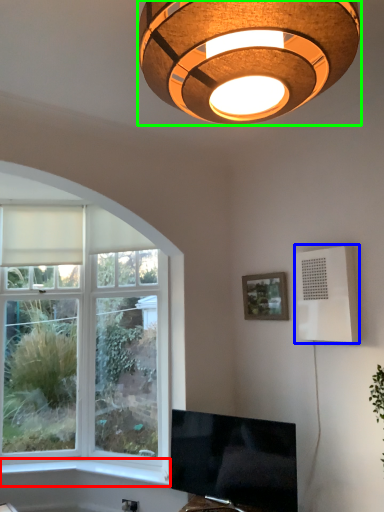
Question: Based on their relative distances, which object is farther from window sill (highlighted by a red box)? Choose from air conditioning (highlighted by a blue box) and lamp (highlighted by a green box).

Choices:
 (A) air conditioning
 (B) lamp

Answer: (B)